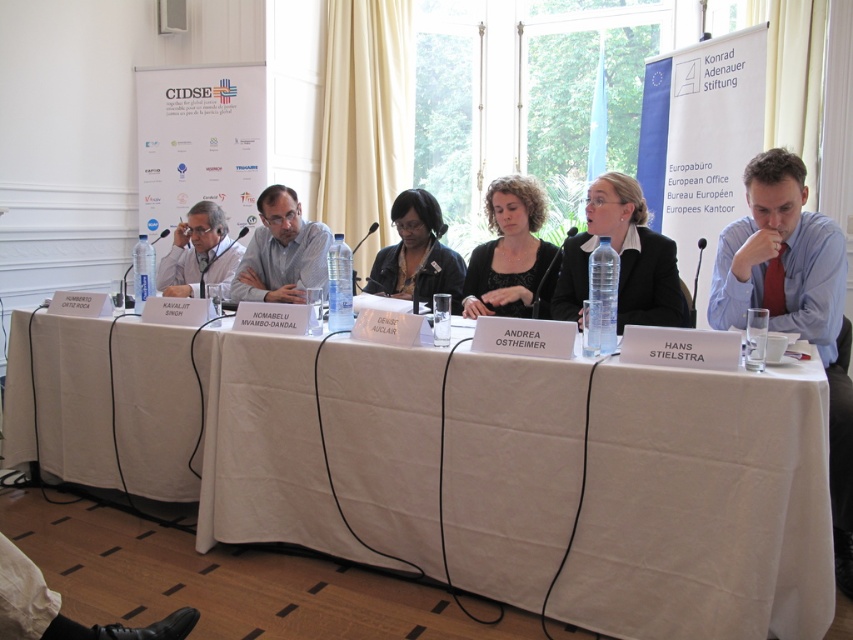
Can you confirm if black glossy suit at center is shorter than gray striped shirt at center?

No, black glossy suit at center is not shorter than gray striped shirt at center.

Does point (659, 234) come behind point (285, 285)?

No, it is not.

Which is in front, point (657, 269) or point (300, 236)?

Point (657, 269) is more forward.

This screenshot has width=853, height=640. Identify the location of black glossy suit at center. (622, 259).

Based on the photo, who is positioned more to the left, white fabric table at center or gray striped shirt at center?

gray striped shirt at center is more to the left.

Is white fabric table at center smaller than gray striped shirt at center?

No, white fabric table at center is not smaller than gray striped shirt at center.

The height and width of the screenshot is (640, 853). In order to click on white fabric table at center in this screenshot , I will do `click(701, 506)`.

Is blue shirt at right to the left of black glossy suit at center from the viewer's perspective?

No, blue shirt at right is not to the left of black glossy suit at center.

Does point (767, 196) come farther from viewer compared to point (672, 266)?

No.

Is point (712, 304) positioned before point (683, 324)?

That is True.

The image size is (853, 640). In order to click on blue shirt at right in this screenshot , I will do `click(781, 257)`.